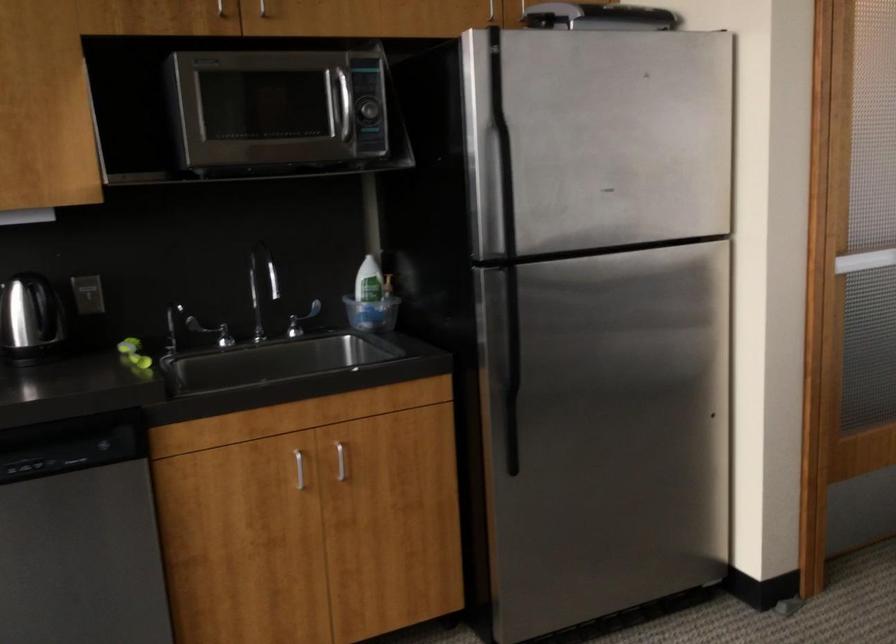
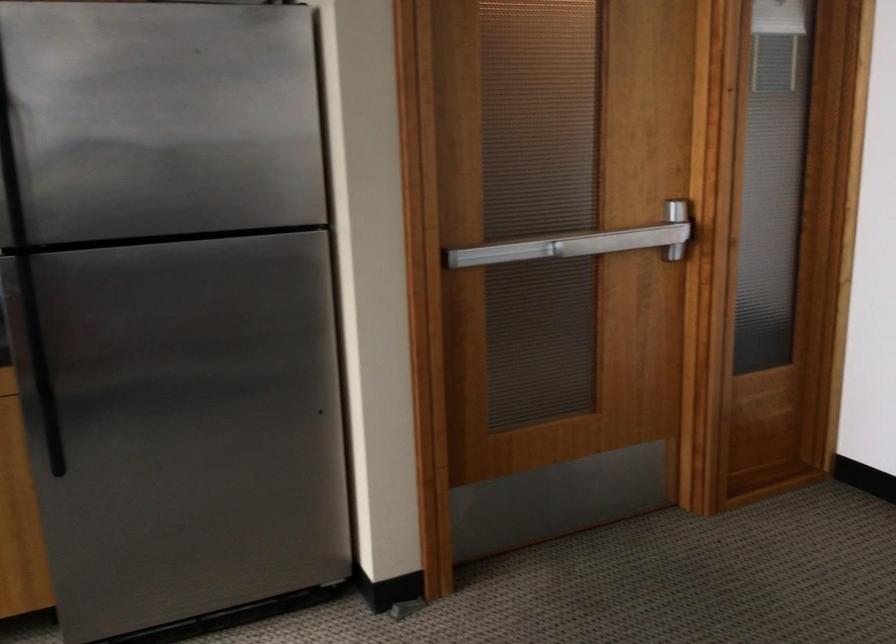
Where in the second image is the point corresponding to point 485,355 from the first image?

(37, 352)